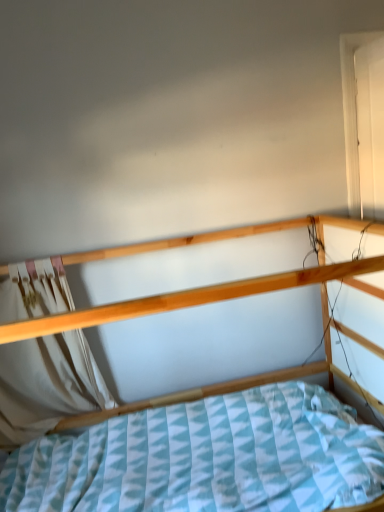
Question: Can you confirm if wooden bed at center is smaller than white wood door at upper right?

Choices:
 (A) no
 (B) yes

Answer: (A)

Question: Does wooden bed at center appear on the left side of white wood door at upper right?

Choices:
 (A) yes
 (B) no

Answer: (A)

Question: Does wooden bed at center appear on the right side of white wood door at upper right?

Choices:
 (A) yes
 (B) no

Answer: (B)

Question: Is wooden bed at center aimed at white wood door at upper right?

Choices:
 (A) no
 (B) yes

Answer: (A)

Question: Are wooden bed at center and white wood door at upper right located far from each other?

Choices:
 (A) yes
 (B) no

Answer: (B)

Question: Visually, is white fabric curtain at left positioned to the left or to the right of wooden bed at center?

Choices:
 (A) left
 (B) right

Answer: (A)

Question: Based on their sizes in the image, would you say white fabric curtain at left is bigger or smaller than wooden bed at center?

Choices:
 (A) big
 (B) small

Answer: (B)

Question: Considering their positions, is white fabric curtain at left located in front of or behind wooden bed at center?

Choices:
 (A) behind
 (B) front

Answer: (A)

Question: Choose the correct answer: Is white fabric curtain at left inside wooden bed at center or outside it?

Choices:
 (A) inside
 (B) outside

Answer: (A)

Question: Relative to white fabric curtain at left, is white wood door at upper right in front or behind?

Choices:
 (A) behind
 (B) front

Answer: (A)

Question: Which is correct: white wood door at upper right is inside white fabric curtain at left, or outside of it?

Choices:
 (A) inside
 (B) outside

Answer: (B)

Question: From the image's perspective, relative to white fabric curtain at left, is white wood door at upper right above or below?

Choices:
 (A) below
 (B) above

Answer: (B)

Question: Is point (347, 45) closer or farther from the camera than point (11, 296)?

Choices:
 (A) farther
 (B) closer

Answer: (A)

Question: Is point (226, 381) positioned closer to the camera than point (360, 41)?

Choices:
 (A) closer
 (B) farther

Answer: (B)

Question: From the image's perspective, is wooden bed at center above or below white wood door at upper right?

Choices:
 (A) below
 (B) above

Answer: (A)